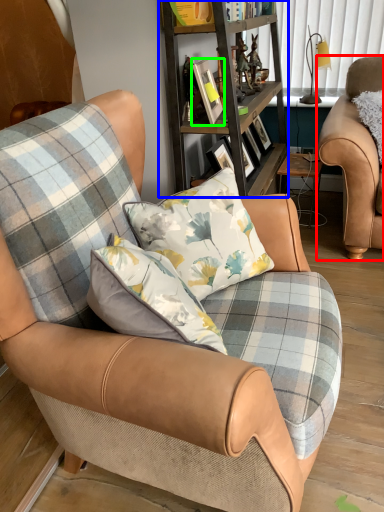
Question: Which is farther away from chair (highlighted by a red box)? shelf (highlighted by a blue box) or picture frame (highlighted by a green box)?

Choices:
 (A) shelf
 (B) picture frame

Answer: (B)